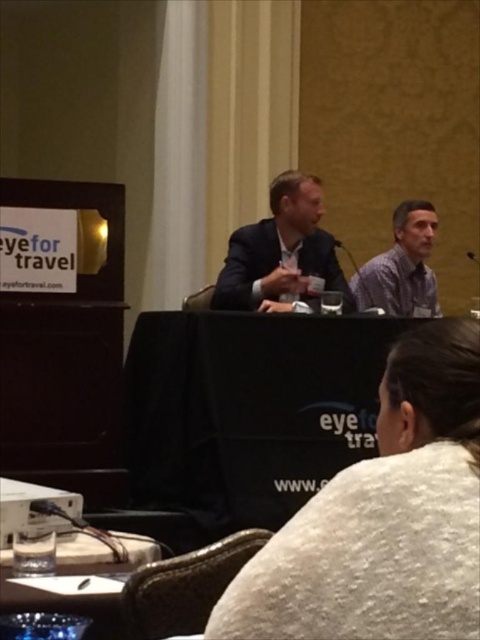
You are an event organizer who needs to arrange name tags for the speakers. The name tag for the person in the matte black suit at center should be placed where in relation to the gray fabric shirt at right?

The matte black suit at center is located below the gray fabric shirt at right, so the name tag for the matte black suit at center should be placed below the gray fabric shirt at right.

In the panel discussion scene, there are two men seated behind the table. One is wearing a matte black suit at center and the other a gray fabric shirt at right. Which of these two items is taller?

The matte black suit at center is taller than the gray fabric shirt at right.

You are an event planner trying to arrange a microphone stand between the white fuzzy sweater at lower center and the matte black suit at center. Based on their positions, where should you place the microphone stand to ensure it is between them?

The white fuzzy sweater at lower center is located below the matte black suit at center, so the microphone stand should be placed between the lower area where the white fuzzy sweater at lower center is and the central position of the matte black suit at center.